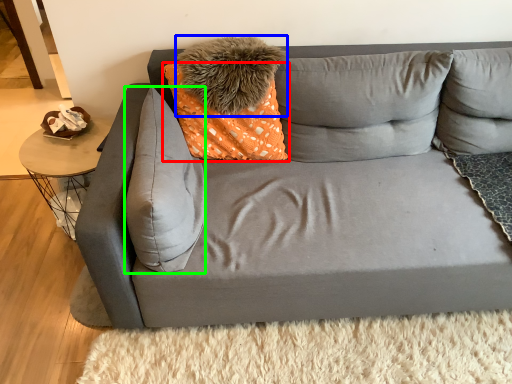
Question: Based on their relative distances, which object is nearer to pillow (highlighted by a red box)? Choose from pillow (highlighted by a blue box) and pillow (highlighted by a green box).

Choices:
 (A) pillow
 (B) pillow

Answer: (A)